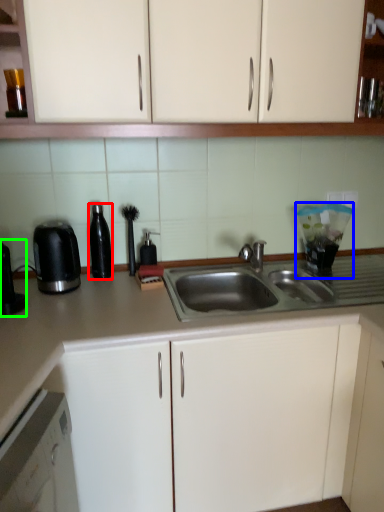
Question: Which is nearer to the appliance (highlighted by a red box)? appliance (highlighted by a blue box) or coffee machine (highlighted by a green box).

Choices:
 (A) appliance
 (B) coffee machine

Answer: (B)